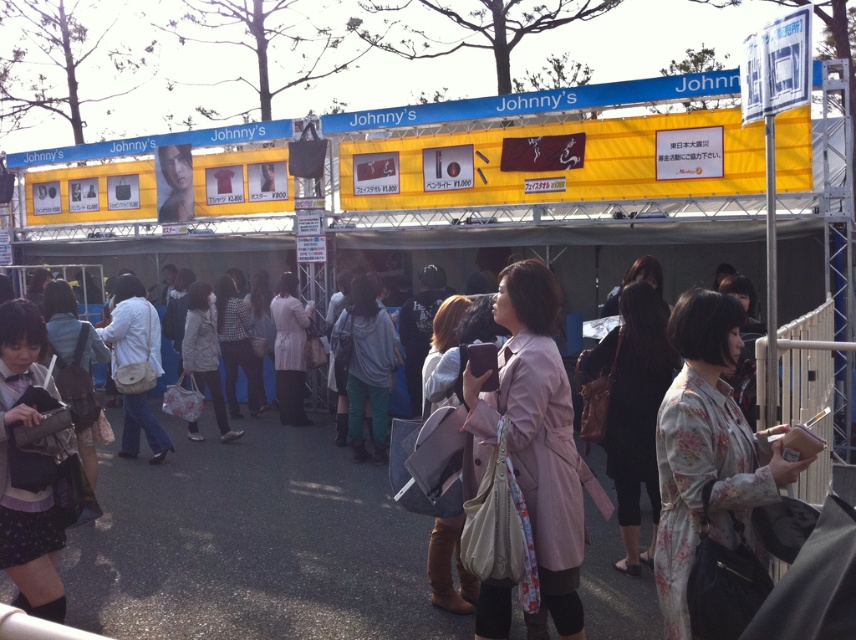
Question: Can you confirm if floral-patterned fabric at center is positioned to the right of pink fabric coat at center?

Choices:
 (A) no
 (B) yes

Answer: (B)

Question: Is floral-patterned fabric at center positioned at the back of pink fabric coat at center?

Choices:
 (A) yes
 (B) no

Answer: (B)

Question: Does floral-patterned fabric at center have a larger size compared to pink fabric coat at center?

Choices:
 (A) no
 (B) yes

Answer: (A)